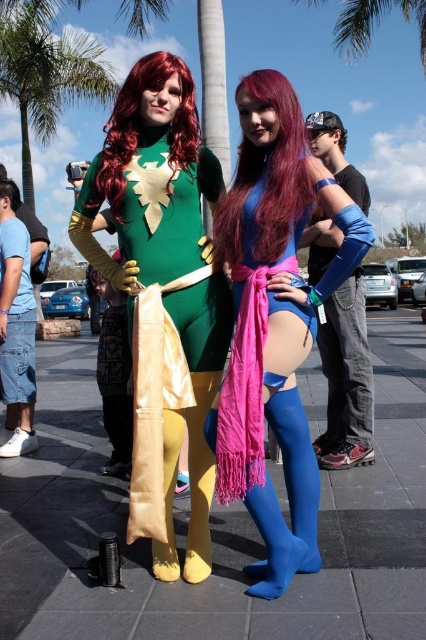
Question: Which of the following is the closest to the observer?

Choices:
 (A) blue spandex leggings at center
 (B) green leafy palm tree at upper center

Answer: (A)

Question: Does blue spandex leggings at center come behind green matte bodysuit at center?

Choices:
 (A) no
 (B) yes

Answer: (A)

Question: Which object is farther from the camera taking this photo?

Choices:
 (A) green matte bodysuit at center
 (B) green leafy palm tree at upper center
 (C) blue spandex leggings at center
 (D) green leafy palm tree at upper left

Answer: (B)

Question: Is blue spandex leggings at center to the right of green leafy palm tree at upper center from the viewer's perspective?

Choices:
 (A) yes
 (B) no

Answer: (B)

Question: Estimate the real-world distances between objects in this image. Which object is farther from the green leafy palm tree at upper center?

Choices:
 (A) green leafy palm tree at upper left
 (B) green matte bodysuit at center
 (C) blue spandex leggings at center

Answer: (C)

Question: Does blue spandex leggings at center have a smaller size compared to green matte bodysuit at center?

Choices:
 (A) no
 (B) yes

Answer: (B)